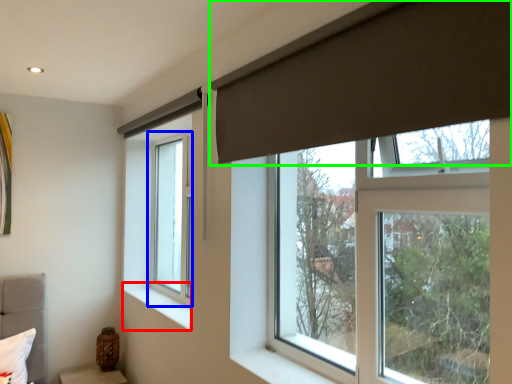
Question: Considering the real-world distances, which object is closest to window sill (highlighted by a red box)? window (highlighted by a blue box) or curtain (highlighted by a green box).

Choices:
 (A) window
 (B) curtain

Answer: (A)